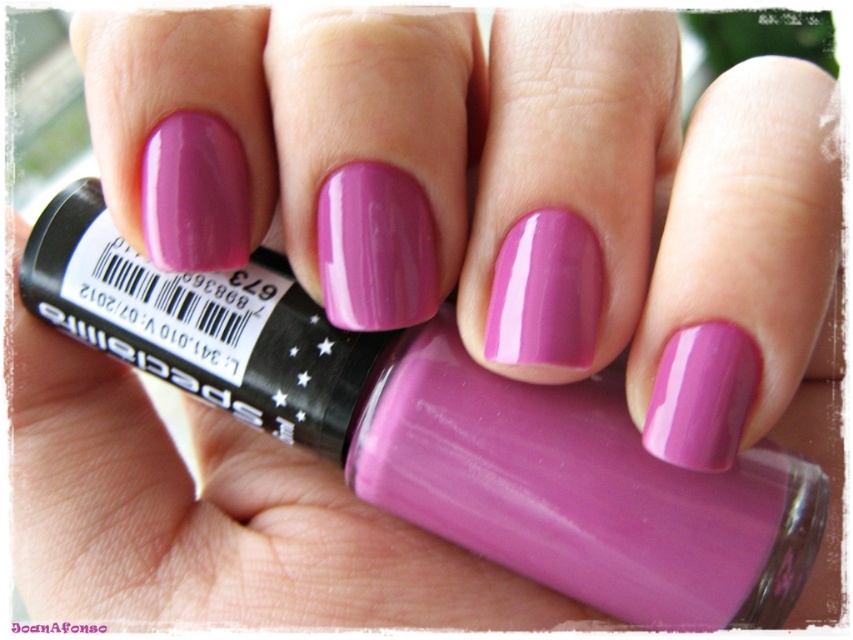
You are a painter standing 20 inches away from the image. Can you reach the point at coordinates point (283, 276) without moving your position?

The distance of point (283, 276) from viewer is 18.37 inches, so yes, the painter can reach the point at coordinates point (283, 276) without moving their position since they are only 18.37 inches away, which is within the 20 inches distance.

You are a customer at a beauty store holding two nail polish bottles, the matte purple nail polish at center and the glossy purple nail polish at center. You want to place both bottles on a shelf but need to know their positions relative to you. Which bottle is closer to your hand when you pick them up?

The matte purple nail polish at center is closer to your hand because it is positioned further to the viewer than the glossy purple nail polish at center, meaning it is nearer to you.

You are a nail artist observing a hand with pink nails and a bottle of nail polish. You notice a specific point at coordinates point (447, 433). What color nail polish is located at that point?

The point (447, 433) has matte purple nail polish at center.